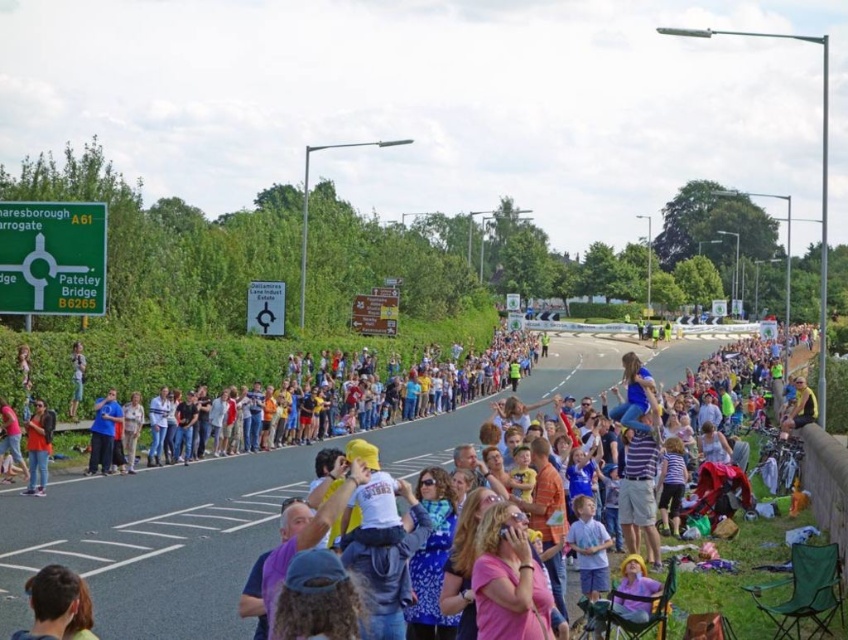
Question: Among these points, which one is nearest to the camera?

Choices:
 (A) (65, 568)
 (B) (433, 625)
 (C) (43, 413)

Answer: (A)

Question: Can you confirm if matte white crowd at center is bigger than matte black jacket at lower left?

Choices:
 (A) yes
 (B) no

Answer: (A)

Question: Does matte white crowd at center have a larger size compared to blue fabric shirt at center?

Choices:
 (A) no
 (B) yes

Answer: (B)

Question: Is matte black jacket at lower left positioned at the back of blue fabric shirt at center?

Choices:
 (A) no
 (B) yes

Answer: (A)

Question: Which of the following is the farthest from the observer?

Choices:
 (A) matte black jacket at lower left
 (B) matte white crowd at center
 (C) dark brown hair at lower left
 (D) blue fabric shirt at center

Answer: (D)

Question: Among these points, which one is farthest from the camera?

Choices:
 (A) (721, 408)
 (B) (118, 410)
 (C) (26, 451)
 (D) (32, 632)

Answer: (A)